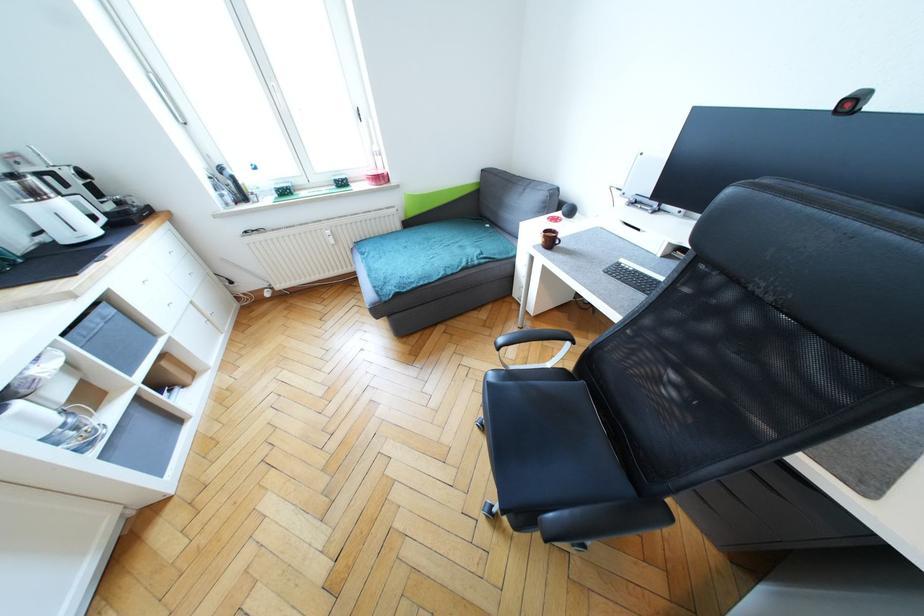
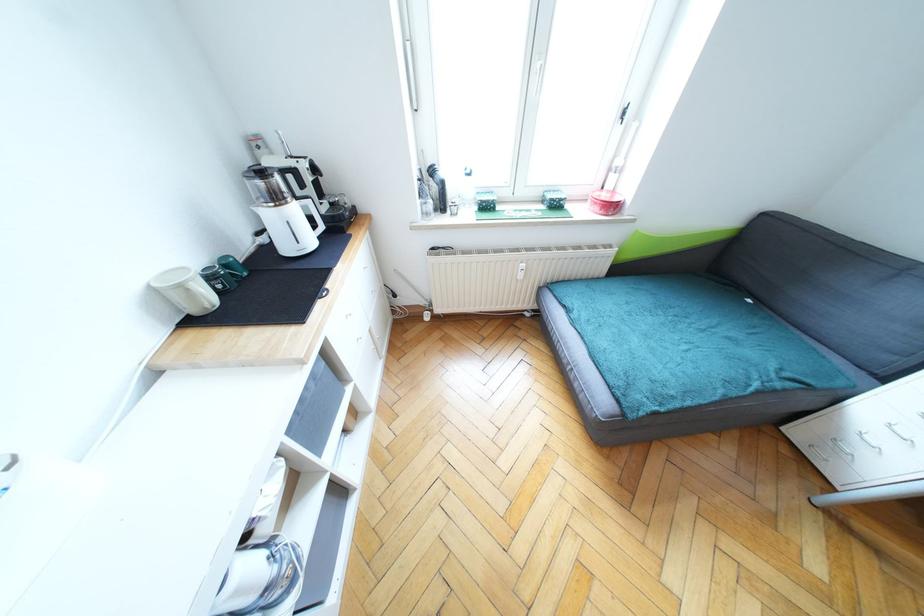
The images are taken continuously from a first-person perspective. In which direction are you moving?

The cameraman moved toward left, forward.